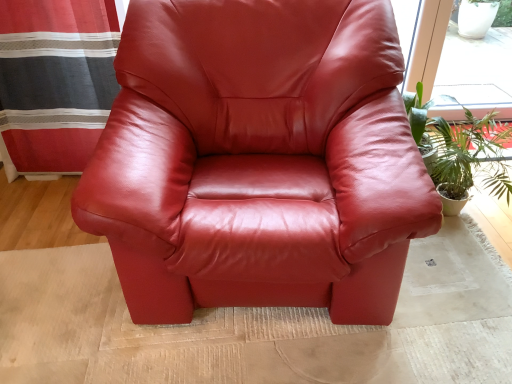
At what (x,y) coordinates should I click in order to perform the action: click on striped fabric curtain at left. Please return your answer as a coordinate pair (x, y). The height and width of the screenshot is (384, 512). Looking at the image, I should click on (56, 80).

Locate an element on the screen. satin red armchair at center is located at coordinates (258, 160).

From the picture: Considering the positions of objects green leafy plant at right and striped fabric curtain at left in the image provided, who is more to the left, green leafy plant at right or striped fabric curtain at left?

striped fabric curtain at left is more to the left.

Locate an element on the screen. This screenshot has width=512, height=384. houseplant that appears below the striped fabric curtain at left (from a real-world perspective) is located at coordinates (460, 151).

Between green leafy plant at right and striped fabric curtain at left, which one has smaller size?

green leafy plant at right is smaller.

You are a GUI agent. You are given a task and a screenshot of the screen. Output one action in this format:
    pyautogui.click(x=<x>, y=<y>)
    Task: Click on the chair in front of the green leafy plant at right
    
    Given the screenshot: What is the action you would take?
    pyautogui.click(x=258, y=160)

In the image, is satin red armchair at center positioned in front of or behind green leafy plant at right?

satin red armchair at center is positioned closer to the viewer than green leafy plant at right.

From the picture: Does satin red armchair at center contain green leafy plant at right?

Definitely not — green leafy plant at right is not inside satin red armchair at center.

Considering the relative positions of satin red armchair at center and green leafy plant at right in the image provided, is satin red armchair at center to the left or to the right of green leafy plant at right?

From the image, it's evident that satin red armchair at center is to the left of green leafy plant at right.

Where is `curtain above the green leafy plant at right (from a real-world perspective)`? This screenshot has width=512, height=384. curtain above the green leafy plant at right (from a real-world perspective) is located at coordinates (56, 80).

Does striped fabric curtain at left have a smaller size compared to green leafy plant at right?

Actually, striped fabric curtain at left might be larger than green leafy plant at right.

Is point (58, 101) more distant than point (462, 164)?

That is True.

In the scene shown: Would you say striped fabric curtain at left is outside green leafy plant at right?

Yes.

Considering the sizes of objects striped fabric curtain at left and satin red armchair at center in the image provided, who is bigger, striped fabric curtain at left or satin red armchair at center?

satin red armchair at center is bigger.

From the image's perspective, is striped fabric curtain at left located above or below satin red armchair at center?

From the image's perspective, striped fabric curtain at left appears above satin red armchair at center.

From a real-world perspective, which object stands above the other?

satin red armchair at center is physically above.

Which object is positioned more to the left, striped fabric curtain at left or satin red armchair at center?

striped fabric curtain at left is more to the left.

Which of these two, satin red armchair at center or striped fabric curtain at left, is bigger?

With larger size is satin red armchair at center.

Considering the relative positions of satin red armchair at center and striped fabric curtain at left in the image provided, is satin red armchair at center to the right of striped fabric curtain at left from the viewer's perspective?

Indeed, satin red armchair at center is positioned on the right side of striped fabric curtain at left.

The width and height of the screenshot is (512, 384). What are the coordinates of `chair that is below the striped fabric curtain at left (from the image's perspective)` in the screenshot? It's located at coord(258,160).

The height and width of the screenshot is (384, 512). What are the coordinates of `houseplant directly beneath the satin red armchair at center (from a real-world perspective)` in the screenshot? It's located at (460, 151).

Which is nearer, [464,136] or [331,78]?

The point [331,78] is more forward.

At what (x,y) coordinates should I click in order to perform the action: click on houseplant below the striped fabric curtain at left (from a real-world perspective). Please return your answer as a coordinate pair (x, y). The height and width of the screenshot is (384, 512). Looking at the image, I should click on (460, 151).

Where is `chair above the green leafy plant at right (from a real-world perspective)`? The image size is (512, 384). chair above the green leafy plant at right (from a real-world perspective) is located at coordinates (258, 160).

Estimate the real-world distances between objects in this image. Which object is further from striped fabric curtain at left, satin red armchair at center or green leafy plant at right?

Among the two, green leafy plant at right is located further to striped fabric curtain at left.

From the image, which object appears to be farther from striped fabric curtain at left, green leafy plant at right or satin red armchair at center?

green leafy plant at right is further to striped fabric curtain at left.

Based on their spatial positions, is striped fabric curtain at left or green leafy plant at right further from satin red armchair at center?

Based on the image, striped fabric curtain at left appears to be further to satin red armchair at center.

When comparing their distances from green leafy plant at right, does striped fabric curtain at left or satin red armchair at center seem further?

Among the two, striped fabric curtain at left is located further to green leafy plant at right.

Consider the image. Looking at the image, which one is located further to green leafy plant at right, satin red armchair at center or striped fabric curtain at left?

Based on the image, striped fabric curtain at left appears to be further to green leafy plant at right.

When comparing their distances from satin red armchair at center, does green leafy plant at right or striped fabric curtain at left seem closer?

green leafy plant at right is positioned closer to the anchor satin red armchair at center.

The height and width of the screenshot is (384, 512). Find the location of `chair between striped fabric curtain at left and green leafy plant at right in the horizontal direction`. chair between striped fabric curtain at left and green leafy plant at right in the horizontal direction is located at coordinates 258,160.